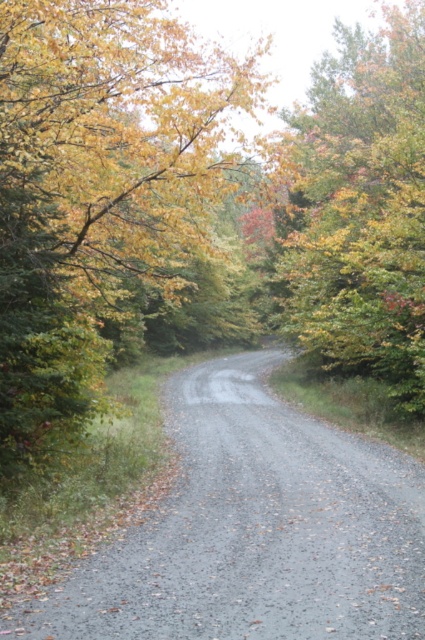
The width and height of the screenshot is (425, 640). Describe the element at coordinates (98, 189) in the screenshot. I see `yellow-green foliage at center` at that location.

Does yellow-green foliage at center have a greater height compared to autumn leaves at upper right?

Indeed, yellow-green foliage at center has a greater height compared to autumn leaves at upper right.

Is point (76, 200) farther from viewer compared to point (356, 51)?

No, it is in front of (356, 51).

What are the coordinates of `yellow-green foliage at center` in the screenshot? It's located at (98, 189).

Can you confirm if gray gravel path at center is smaller than autumn leaves at upper right?

Yes.

What do you see at coordinates (254, 531) in the screenshot?
I see `gray gravel path at center` at bounding box center [254, 531].

Does point (282, 595) come closer to viewer compared to point (325, 156)?

Yes, it is.

Find the location of a particular element. gray gravel path at center is located at coordinates (254, 531).

Between point (122, 177) and point (416, 525), which one is positioned in front?

Point (416, 525) is more forward.

Does yellow-green foliage at center have a lesser width compared to gray gravel path at center?

No, yellow-green foliage at center is not thinner than gray gravel path at center.

Describe the element at coordinates (98, 189) in the screenshot. I see `yellow-green foliage at center` at that location.

Image resolution: width=425 pixels, height=640 pixels. I want to click on yellow-green foliage at center, so click(x=98, y=189).